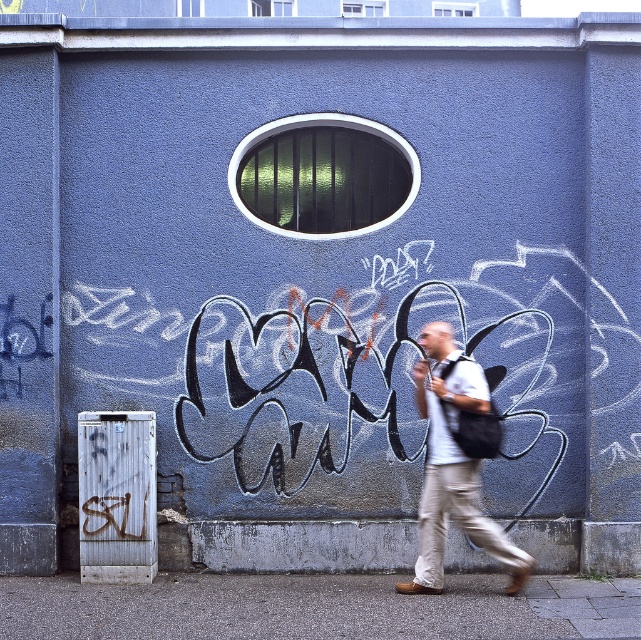
You are standing in front of the graffiti wall and notice two points marked on it. The first point is at coordinates point (x=104, y=630) and the second is at point (x=433, y=349). Which point is closer to you?

Point (x=104, y=630) is closer to the viewer than point (x=433, y=349).

You are a photographer standing in the urban scene. You notice the gray concrete pavement at lower center and the white cotton shirt at center. Which object is closer to the ground?

The gray concrete pavement at lower center is closer to the ground because it is shorter than the white cotton shirt at center.

You are a drone operator trying to map the urban scene. You have a camera that can only focus on objects at coordinates between 0.4 and 0.6 on both axes. Is the gray concrete pavement at lower center within the camera focus range?

The gray concrete pavement at lower center is located at point 0.950 on the x and 0.493 on the y axis. Since the camera can only focus between 0.4 and 0.6 on both axes, the x coordinate of 0.950 is outside the range. Therefore, the gray concrete pavement at lower center is not within the camera focus range.